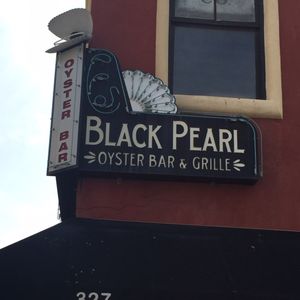
The height and width of the screenshot is (300, 300). I want to click on white fan above sign, so click(150, 94).